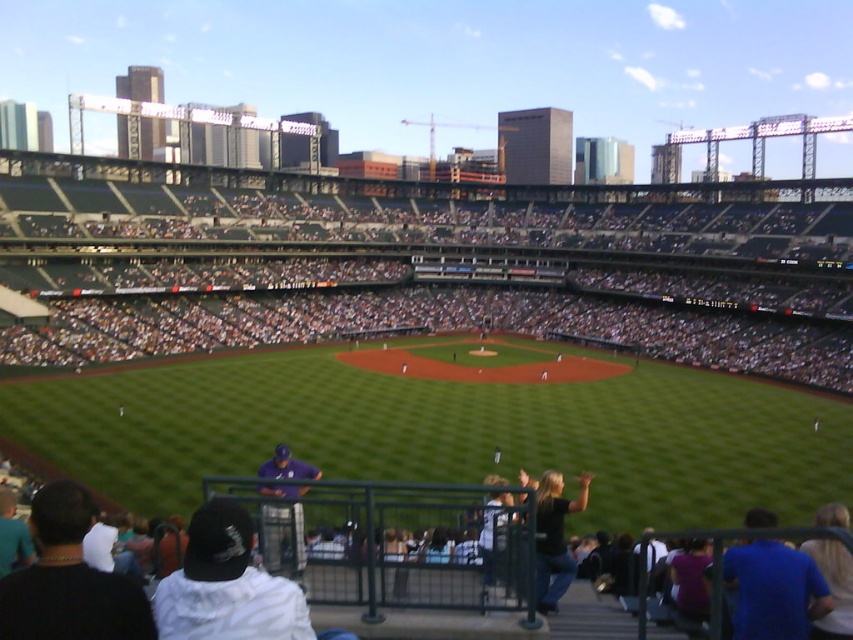
Question: Is the position of blue shirt at lower right more distant than that of purple fabric shirt at lower center?

Choices:
 (A) yes
 (B) no

Answer: (B)

Question: Can you confirm if white fabric cap at lower left is positioned to the right of blue shirt at lower right?

Choices:
 (A) yes
 (B) no

Answer: (B)

Question: Which object is the farthest from the purple fabric shirt at lower center?

Choices:
 (A) dark blue baseball cap at lower left
 (B) dark gray seats at upper center
 (C) blue shirt at lower right
 (D) white fabric cap at lower left

Answer: (B)

Question: Which object appears farthest from the camera in this image?

Choices:
 (A) dark blue baseball cap at lower left
 (B) blue shirt at lower right

Answer: (B)

Question: Where is dark blue baseball cap at lower left located in relation to purple fabric shirt at lower center in the image?

Choices:
 (A) above
 (B) below

Answer: (A)

Question: Which object appears closest to the camera in this image?

Choices:
 (A) black leather jacket at lower center
 (B) dark gray seats at upper center
 (C) blue shirt at lower right
 (D) purple fabric shirt at lower center

Answer: (C)